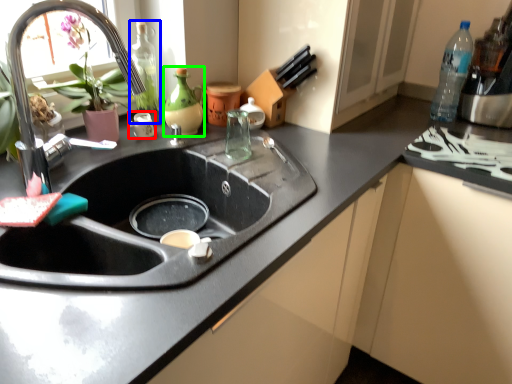
Question: Which object is positioned farthest from appliance (highlighted by a red box)? Select from bottle (highlighted by a blue box) and bottle (highlighted by a green box).

Choices:
 (A) bottle
 (B) bottle

Answer: (B)